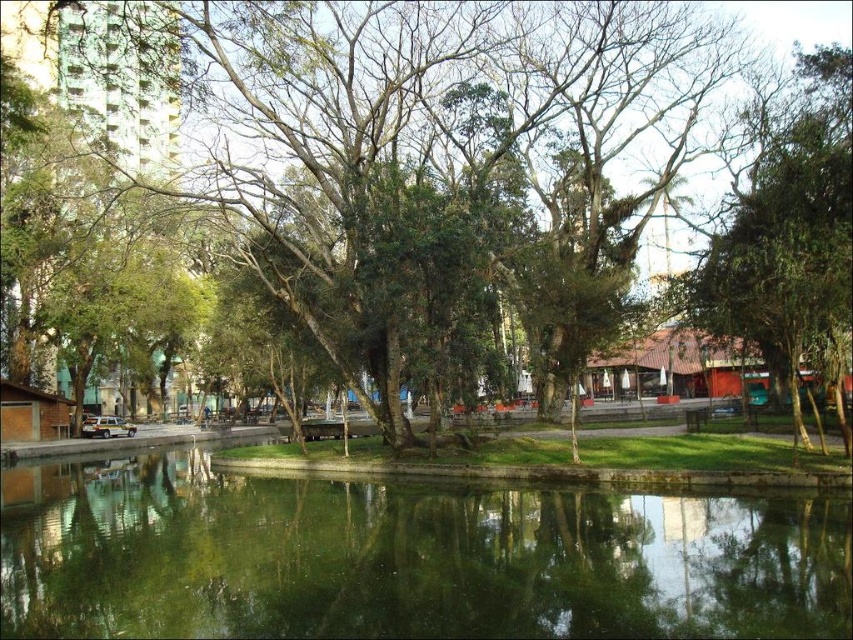
Question: Which object is the closest to the green leafy tree at right?

Choices:
 (A) green leafy tree at center
 (B) green reflective water at center

Answer: (B)

Question: Is green reflective water at center positioned in front of green leafy tree at center?

Choices:
 (A) yes
 (B) no

Answer: (A)

Question: Is green reflective water at center wider than green leafy tree at right?

Choices:
 (A) no
 (B) yes

Answer: (B)

Question: Which object appears farthest from the camera in this image?

Choices:
 (A) green leafy tree at right
 (B) green reflective water at center

Answer: (A)

Question: Does green leafy tree at right appear on the right side of green leafy tree at center?

Choices:
 (A) no
 (B) yes

Answer: (B)

Question: Which of the following is the farthest from the observer?

Choices:
 (A) green reflective water at center
 (B) green leafy tree at center

Answer: (B)